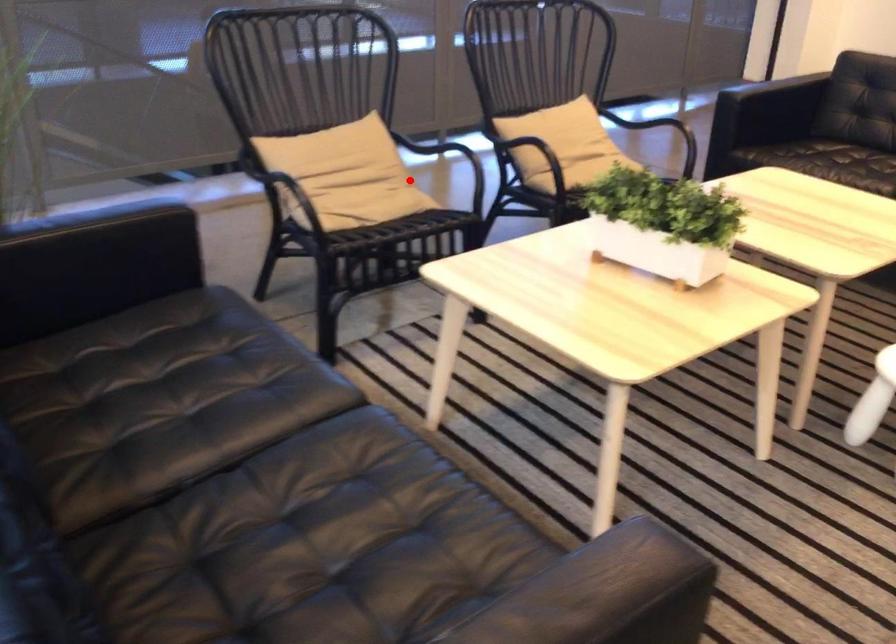
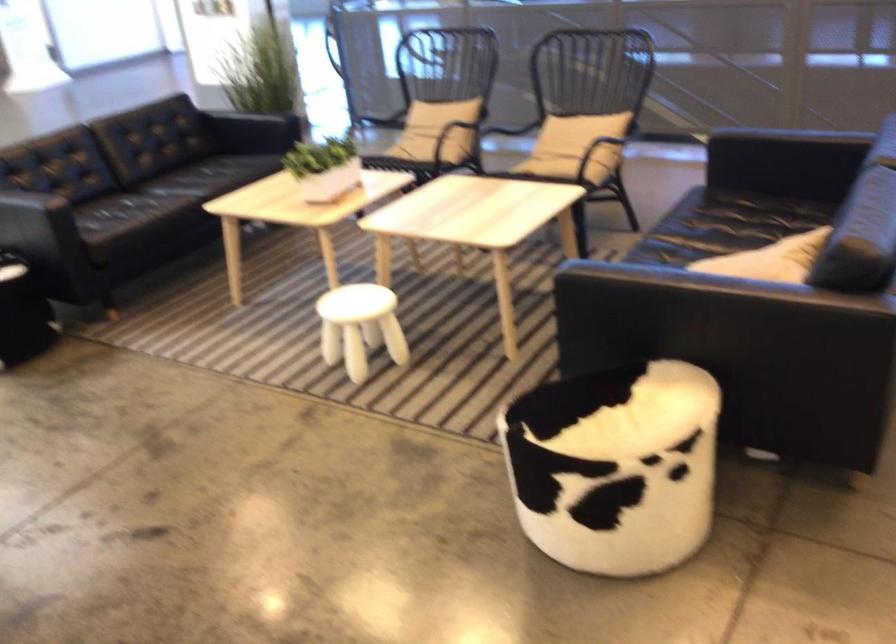
Where in the second image is the point corresponding to the highlighted location from the first image?

(450, 135)